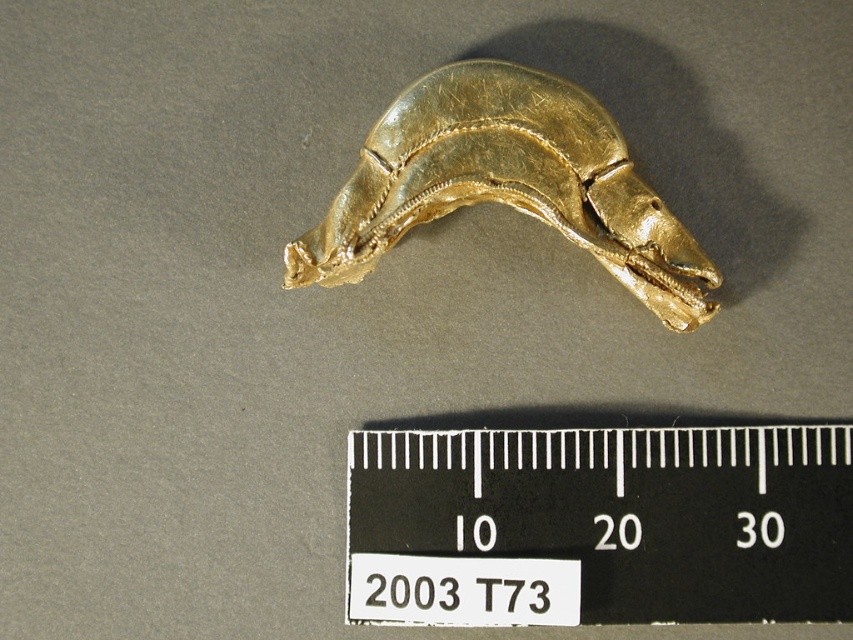
Does black plastic ruler at center appear on the left side of gold shiny horse at center?

In fact, black plastic ruler at center is to the right of gold shiny horse at center.

Based on the photo, which is more to the left, black plastic ruler at center or gold shiny horse at center?

From the viewer's perspective, gold shiny horse at center appears more on the left side.

Which is behind, point (735, 468) or point (630, 182)?

Point (630, 182)

At what (x,y) coordinates should I click in order to perform the action: click on black plastic ruler at center. Please return your answer as a coordinate pair (x, y). This screenshot has height=640, width=853. Looking at the image, I should click on (601, 525).